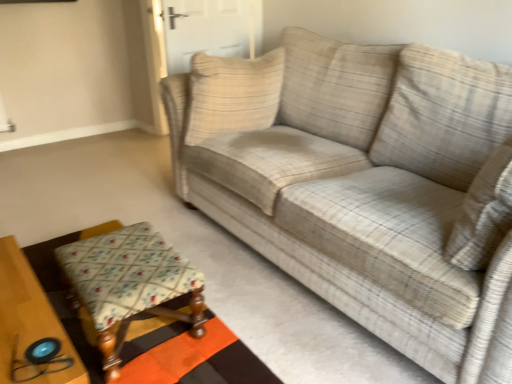
Question: From the image's perspective, is white fabric door at center located above or below floral fabric stool at lower left?

Choices:
 (A) below
 (B) above

Answer: (B)

Question: Looking at their shapes, would you say white fabric door at center is wider or thinner than floral fabric stool at lower left?

Choices:
 (A) wide
 (B) thin

Answer: (B)

Question: Which object is positioned farthest from the plaid fabric couch at center?

Choices:
 (A) beige textured pillow at center
 (B) wooden table at lower left
 (C) white fabric door at center
 (D) floral fabric stool at lower left

Answer: (C)

Question: Based on their relative distances, which object is nearer to the white fabric door at center?

Choices:
 (A) wooden table at lower left
 (B) plaid fabric couch at center
 (C) floral fabric stool at lower left
 (D) beige textured pillow at center

Answer: (D)